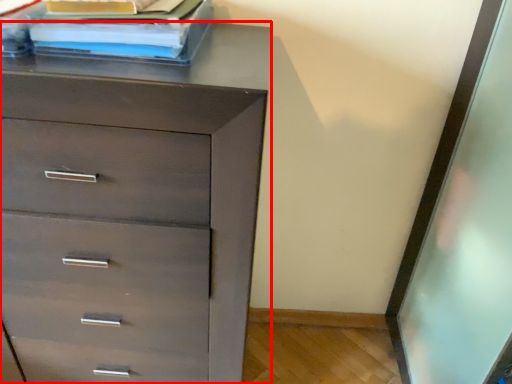
Question: From the image's perspective, what is the correct spatial relationship of chest of drawers (annotated by the red box) in relation to book?

Choices:
 (A) above
 (B) below

Answer: (B)